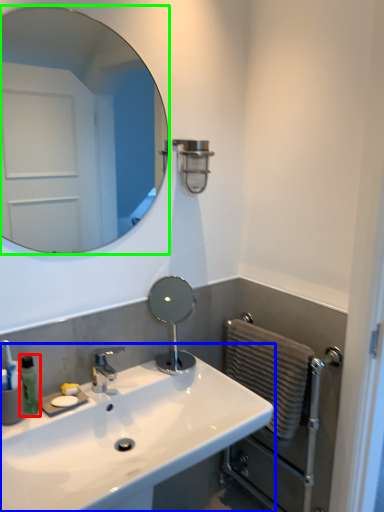
Question: Based on their relative distances, which object is nearer to soap dispenser (highlighted by a red box)? Choose from sink (highlighted by a blue box) and mirror (highlighted by a green box).

Choices:
 (A) sink
 (B) mirror

Answer: (A)